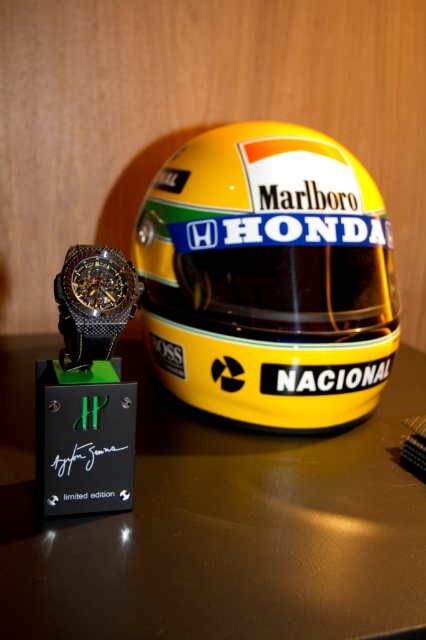
You are a photographer setting up a shoot. You have a yellow matte helmet at center and a black carbon fiber watch at left on a table. You need to place a 10 inch ruler between them to measure the distance. Will the ruler be long enough to span the gap between the two objects?

The yellow matte helmet at center and black carbon fiber watch at left are 12.04 inches apart from each other. The ruler is only 10 inches long, so it will not be long enough to span the gap between the two objects.

You are a photographer setting up a shoot. You have a yellow matte helmet at center and a black carbon fiber watch at left. You need to position a spotlight so it illuminates both objects evenly. Given their sizes, which object should the spotlight be aimed at to ensure both receive adequate light?

The yellow matte helmet at center might be wider than the black carbon fiber watch at left, so aiming the spotlight at the helmet would ensure the smaller watch also gets sufficient light coverage.

You are a photographer setting up a shoot with the yellow matte helmet at center and the black carbon fiber watch at left. You need to adjust the lighting so that both objects are evenly illuminated. Considering their sizes, which object might require a closer light source to ensure proper exposure?

The yellow matte helmet at center is much taller than the black carbon fiber watch at left, so the taller helmet may need a closer light source to ensure proper exposure.